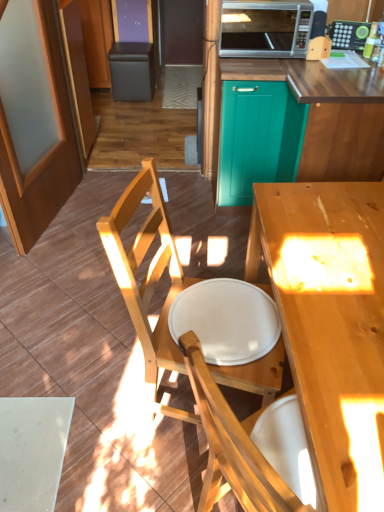
In order to click on vacant space situated on the left part of teal glossy cabinet at center, which appears as the first screen door when viewed from the right in this screenshot , I will do `click(190, 201)`.